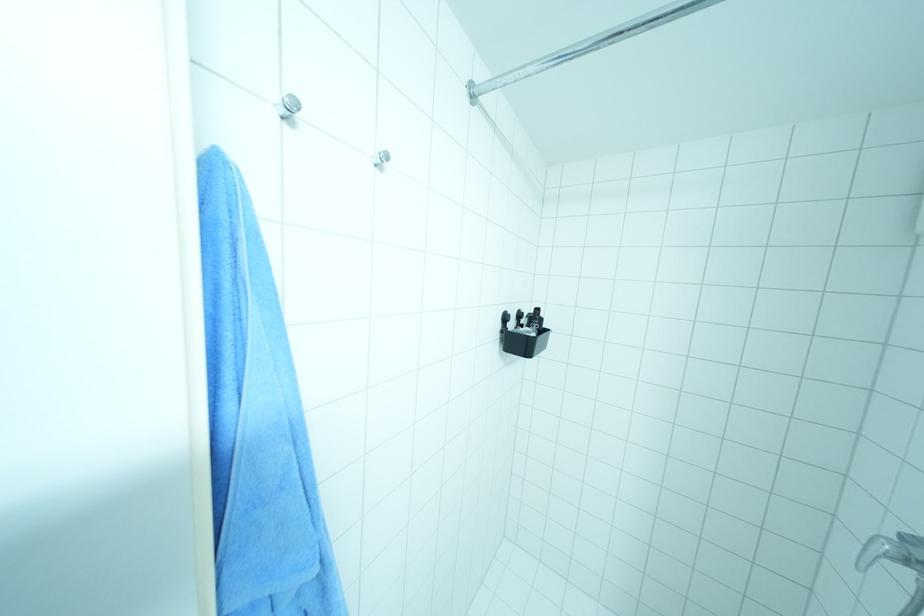
This screenshot has width=924, height=616. I want to click on shower faucet handle, so click(x=876, y=552).